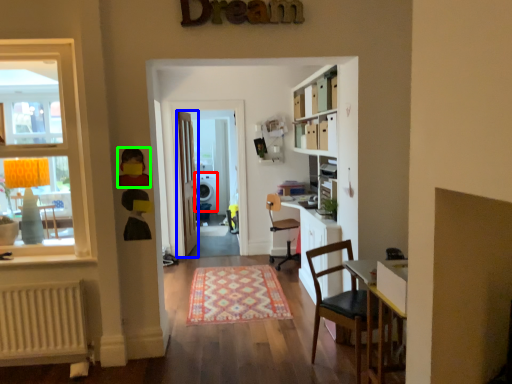
Question: Which object is the farthest from loudspeaker (highlighted by a red box)? Choose among these: door (highlighted by a blue box) or toy (highlighted by a green box).

Choices:
 (A) door
 (B) toy

Answer: (B)